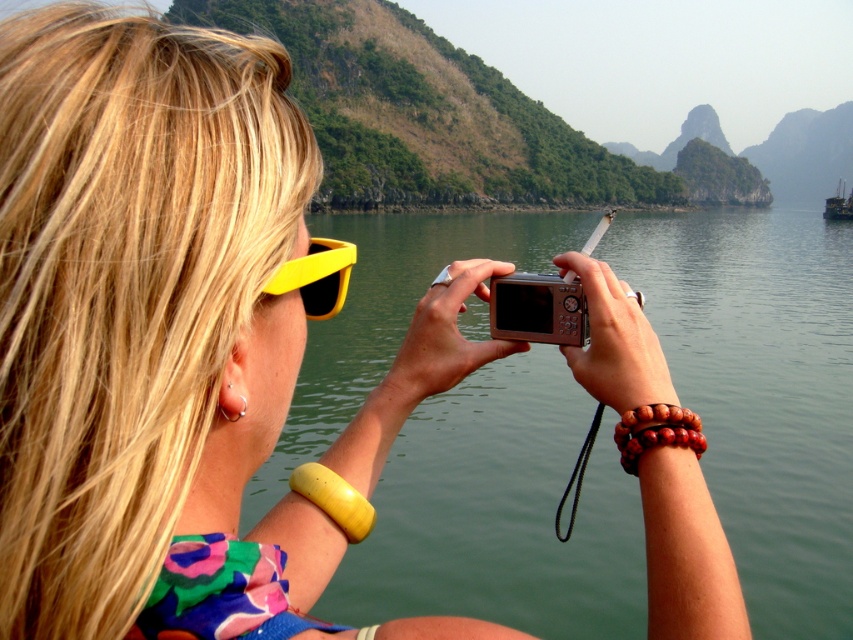
Question: Which is nearer to the metallic gray boat at right?

Choices:
 (A) green water at center
 (B) yellow matte sunglasses at upper left

Answer: (A)

Question: Can you confirm if green water at center is positioned below silver metallic camera at center?

Choices:
 (A) no
 (B) yes

Answer: (A)

Question: Which is farther from the green water at center?

Choices:
 (A) yellow matte sunglasses at upper left
 (B) silver metallic camera at center

Answer: (A)

Question: Is green water at center positioned at the back of metallic gray boat at right?

Choices:
 (A) yes
 (B) no

Answer: (B)

Question: Where is green water at center located in relation to metallic gray boat at right in the image?

Choices:
 (A) below
 (B) above

Answer: (A)

Question: Which point is farther to the camera?

Choices:
 (A) yellow matte sunglasses at upper left
 (B) silver metallic camera at center
 (C) metallic gray boat at right

Answer: (C)